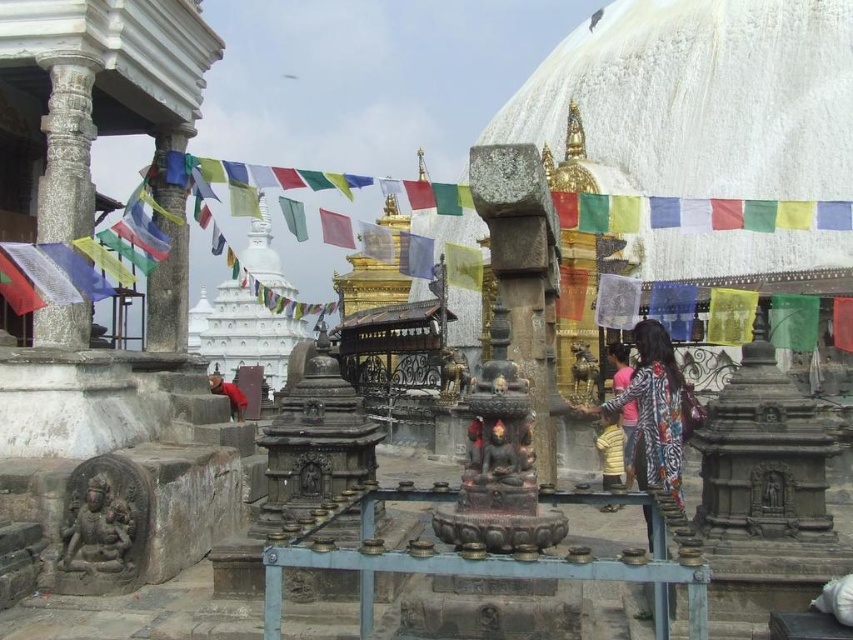
You are a visitor at the temple complex and want to take a photo of the golden structure in the middle ground. You are currently standing at the red fabric person at lower left position. Is the yellow cotton shirt at center in your way to reach the golden structure?

The yellow cotton shirt at center is 102.74 feet away from the red fabric person at lower left. Since the distance is quite large, it is unlikely that the yellow cotton shirt at center is blocking the path to the golden structure in the middle ground.